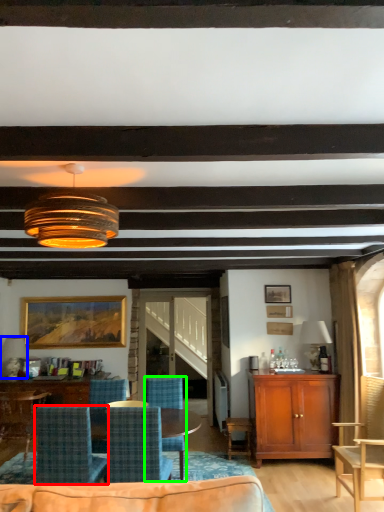
Question: Which object is positioned closest to chair (highlighted by a red box)? Select from lamp (highlighted by a blue box) and chair (highlighted by a green box).

Choices:
 (A) lamp
 (B) chair

Answer: (B)